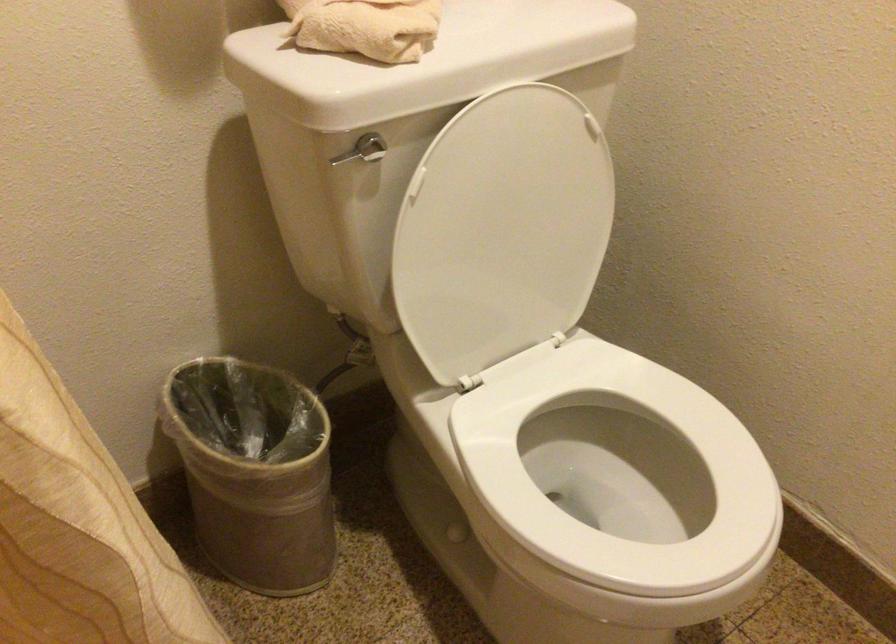
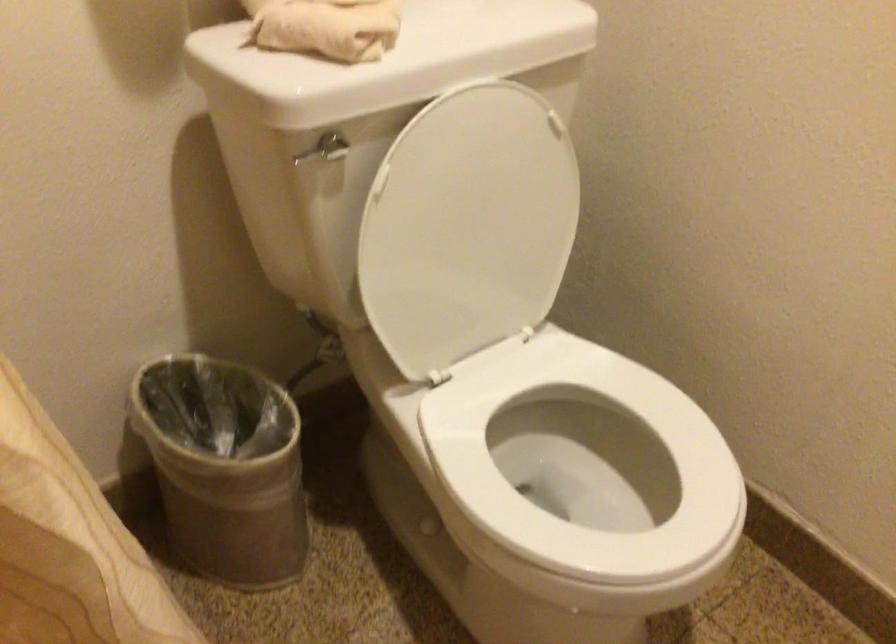
Question: What movement of the cameraman would produce the second image?

Choices:
 (A) Left
 (B) Right
 (C) Forward
 (D) Backward

Answer: (B)